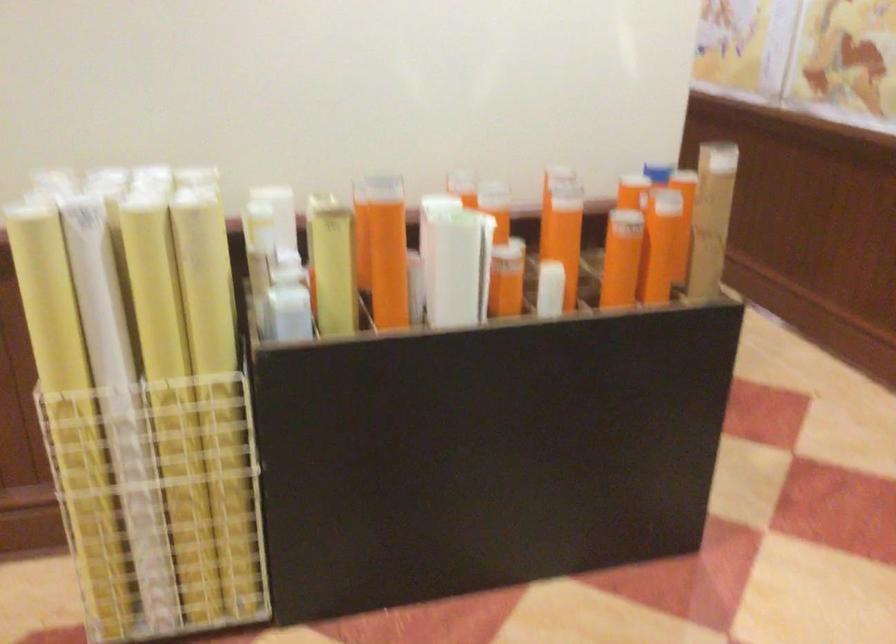
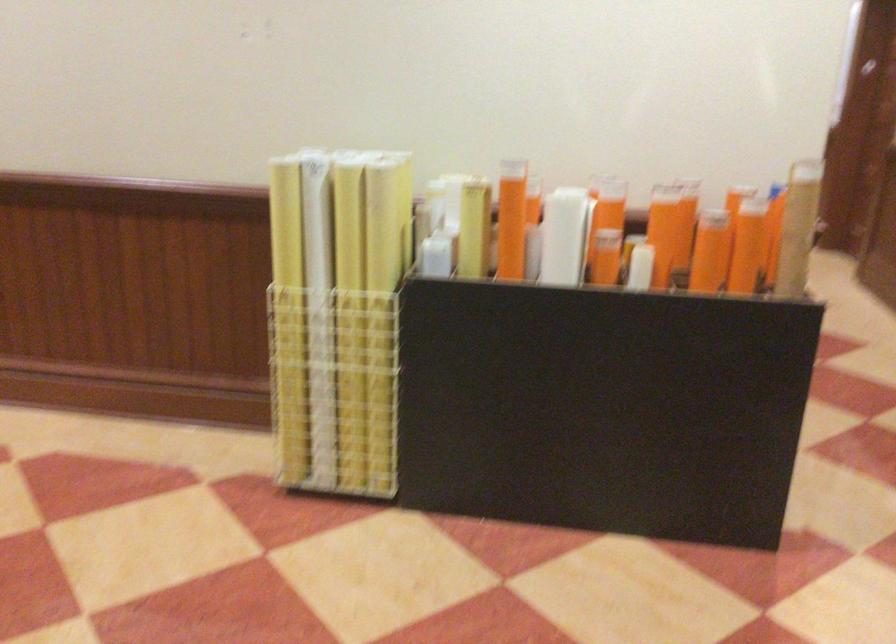
Locate, in the second image, the point that corresponds to (x=459, y=263) in the first image.

(564, 236)